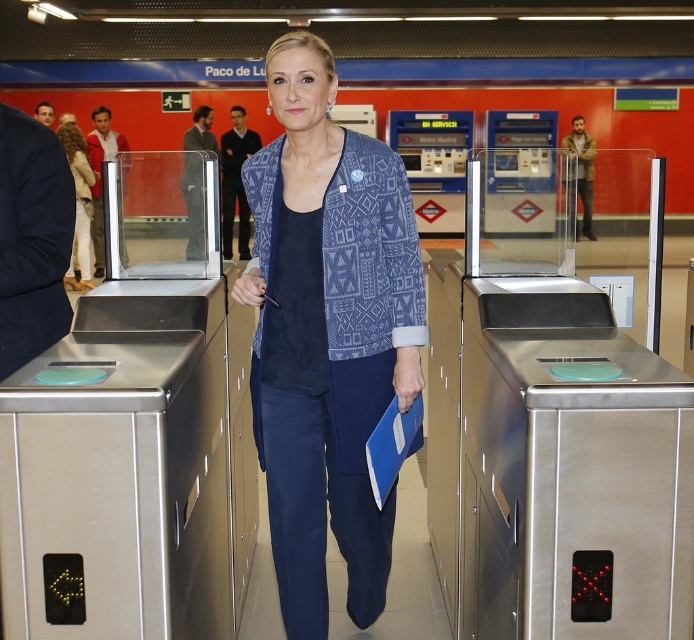
Question: Is blue printed blazer at center further to the viewer compared to light brown leather jacket at upper left?

Choices:
 (A) no
 (B) yes

Answer: (A)

Question: Can you confirm if blue printed blazer at center is positioned to the left of light brown leather jacket at upper left?

Choices:
 (A) yes
 (B) no

Answer: (B)

Question: Which point is closer to the camera?

Choices:
 (A) pos(78,237)
 (B) pos(314,317)

Answer: (B)

Question: Which point is closer to the camera?

Choices:
 (A) (332, 209)
 (B) (90, 180)

Answer: (A)

Question: Does blue printed blazer at center appear on the right side of light brown leather jacket at upper left?

Choices:
 (A) no
 (B) yes

Answer: (B)

Question: Which of the following is the farthest from the observer?

Choices:
 (A) (359, 454)
 (B) (87, 220)

Answer: (B)